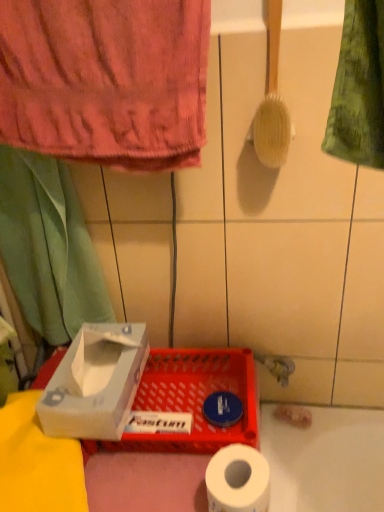
Identify the location of vacant space situated on the left part of white matte toilet paper at lower center. The width and height of the screenshot is (384, 512). (148, 482).